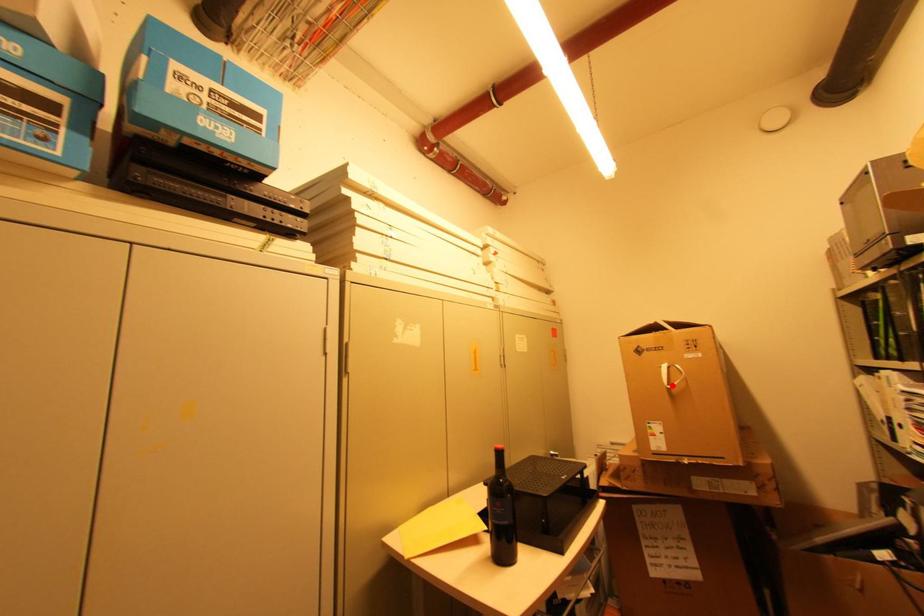
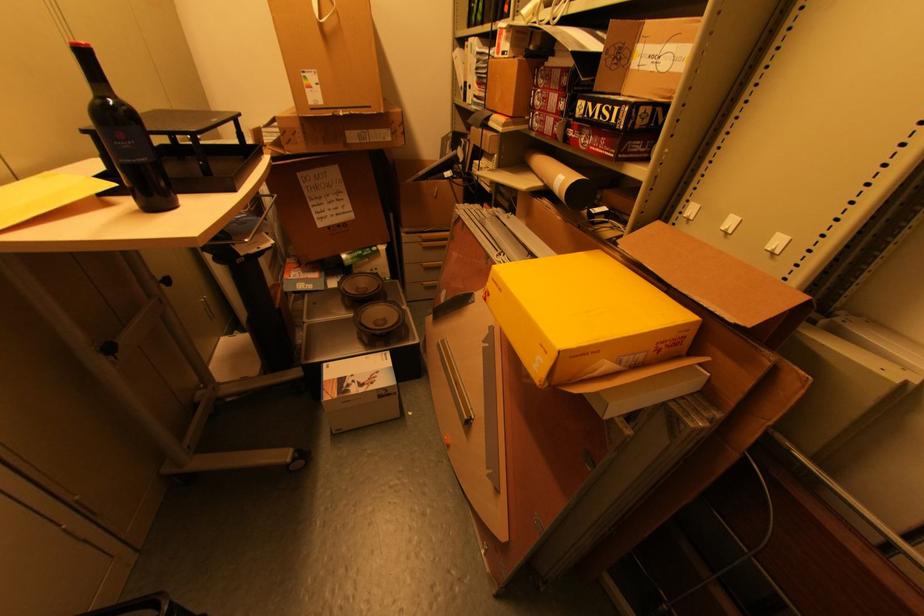
In the second image, find the point that corresponds to the highlighted location in the first image.

(323, 18)